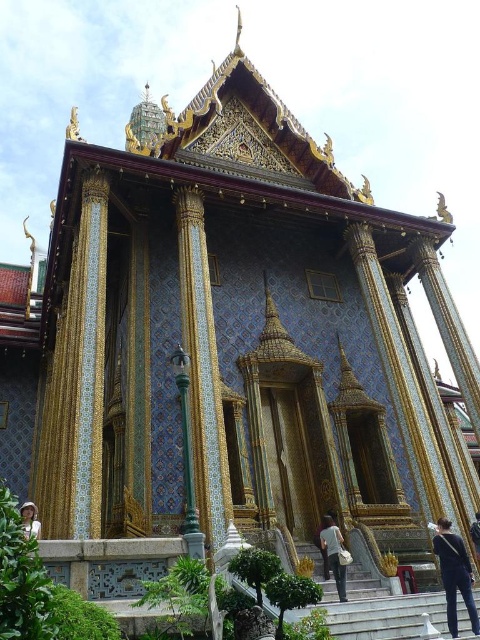
Question: Can you confirm if green glazed tile pillar at center is positioned to the left of white fabric hat at lower center?

Choices:
 (A) yes
 (B) no

Answer: (B)

Question: Can you confirm if green glazed tile pillar at center is smaller than dark blue jeans at lower right?

Choices:
 (A) no
 (B) yes

Answer: (A)

Question: Is green glazed tile pillar at center smaller than dark blue jeans at lower right?

Choices:
 (A) yes
 (B) no

Answer: (B)

Question: Which point appears farthest from the camera in this image?

Choices:
 (A) (455, 605)
 (B) (182, 324)
 (C) (322, 545)
 (D) (27, 516)

Answer: (B)

Question: Which point appears closest to the camera in this image?

Choices:
 (A) (331, 556)
 (B) (468, 604)

Answer: (B)

Question: Which point is closer to the camera taking this photo?

Choices:
 (A) (213, 346)
 (B) (32, 515)

Answer: (B)